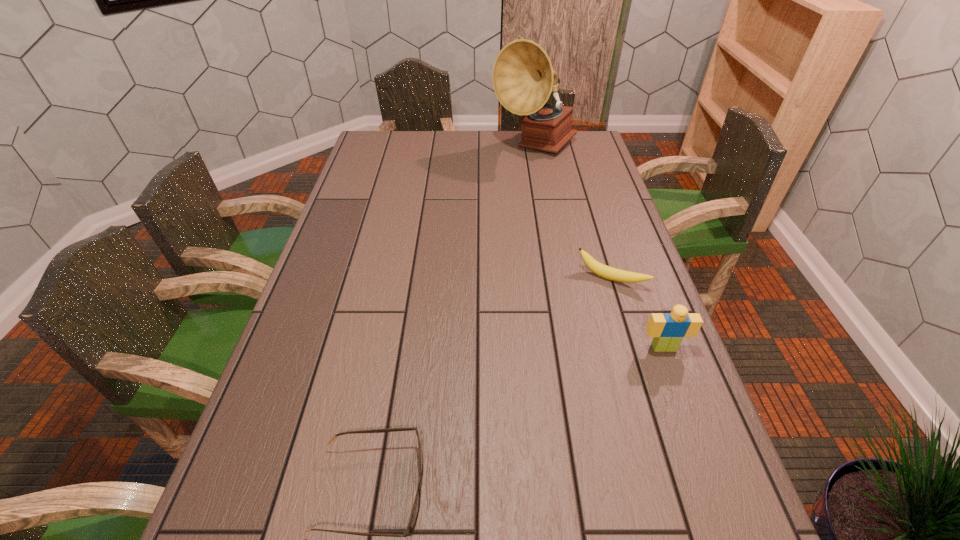
This screenshot has width=960, height=540. What are the coordinates of `free space on the desktop that is between the sunglasses and the Lego and is positioned on the upward curve of the third tallest object` in the screenshot? It's located at (549, 403).

In order to click on vacant space on the desktop that is between the sunglasses and the second tallest object and is positioned on the horn of the farthest object in this screenshot , I will do `click(524, 415)`.